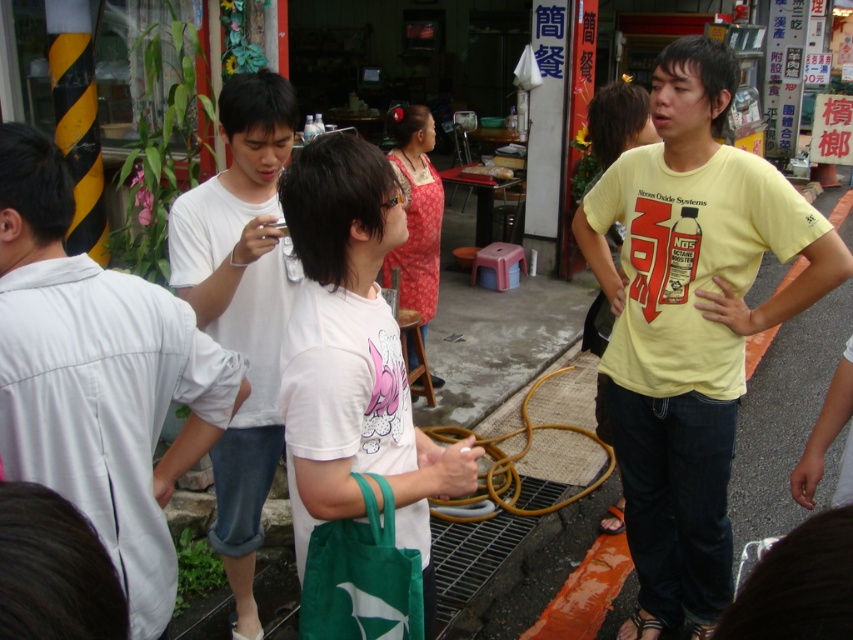
You are a customer standing at the counter of the shop in the scene. You notice two items you want to buy. The first is the white cotton shirt at left, and the second is the green fabric bag at lower center. However, you can only carry one item in each hand. Since you want to hold both items, you need to arrange them properly. Based on their positions in the image, which item should you place in your left hand to ensure it stays above the other?

The white cotton shirt at left is above the green fabric bag at lower center in the image, so you should place the white cotton shirt at left in your left hand and the green fabric bag at lower center in your right hand to mirror their positions, ensuring the shirt stays above the bag.